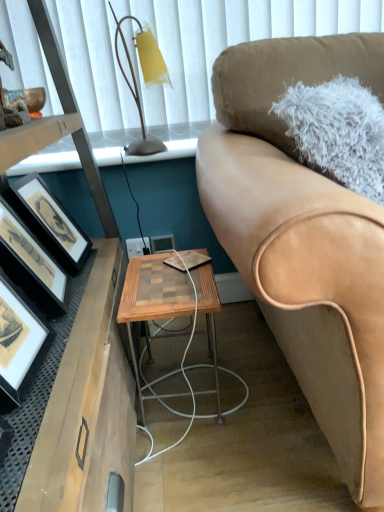
Where is `free location above woodenmaterial/texturetable at center (from a real-world perspective)`? Image resolution: width=384 pixels, height=512 pixels. free location above woodenmaterial/texturetable at center (from a real-world perspective) is located at coordinates (173, 276).